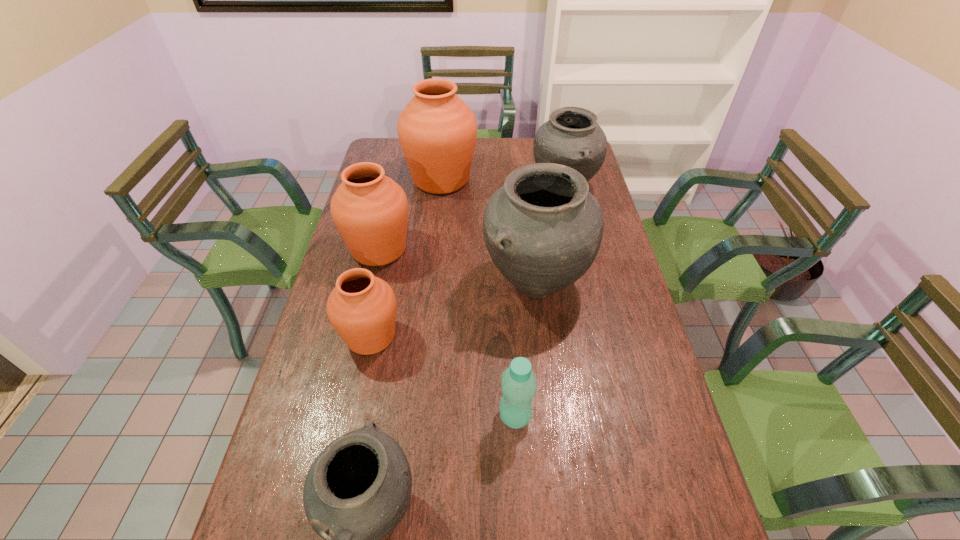
The width and height of the screenshot is (960, 540). I want to click on free space located on the right of the smallest brown urn, so click(480, 336).

This screenshot has height=540, width=960. I want to click on free space located 0.090m on the right of the second nearest object, so click(x=568, y=416).

Find the location of a particular element. Image resolution: width=960 pixels, height=540 pixels. object located in the far edge section of the desktop is located at coordinates (437, 131).

Find the location of a particular element. object that is at the far left corner is located at coordinates (437, 131).

In the image, there is a desktop. Identify the location of free space at the far edge. This screenshot has height=540, width=960. 488,150.

What are the coordinates of `vacant space at the left edge` in the screenshot? It's located at (324, 406).

Identify the location of vacant space at the right edge of the desktop. (605, 380).

Identify the location of unoccupied position between the nearest brown urn and the second nearest object. (443, 376).

Locate an element on the screen. free spot between the biggest black urn and the sixth farthest object is located at coordinates (525, 350).

Find the location of a particular element. The height and width of the screenshot is (540, 960). object that stands as the second closest to the smallest brown urn is located at coordinates (543, 229).